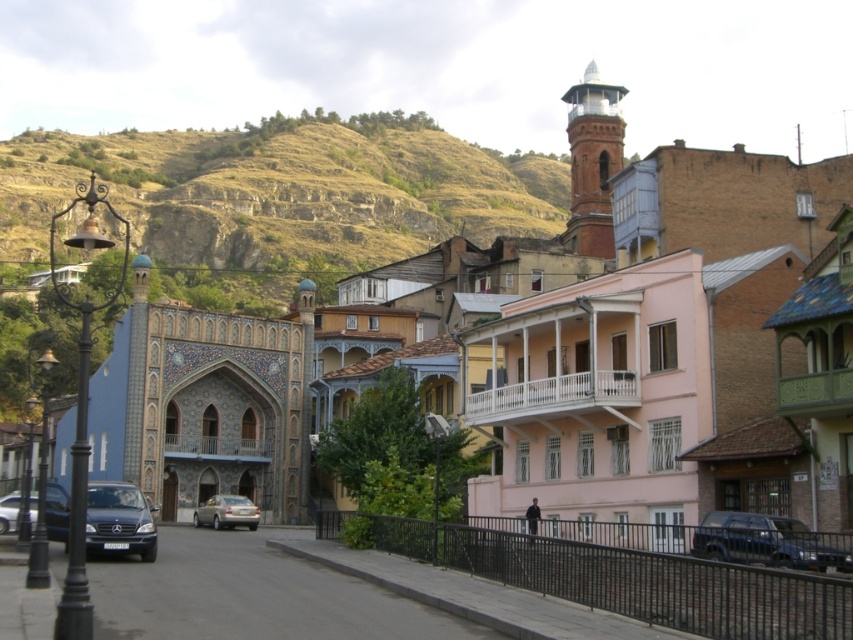
Which of these two, rustic stone hillside at upper left or silver metallic car at center, stands shorter?

With less height is silver metallic car at center.

Is rustic stone hillside at upper left below silver metallic car at center?

No.

This screenshot has height=640, width=853. Describe the element at coordinates (280, 196) in the screenshot. I see `rustic stone hillside at upper left` at that location.

Locate an element on the screen. The height and width of the screenshot is (640, 853). rustic stone hillside at upper left is located at coordinates (280, 196).

Locate an element on the screen. This screenshot has height=640, width=853. rustic stone hillside at upper left is located at coordinates (280, 196).

Can you confirm if rustic stone hillside at upper left is positioned to the left of shiny black sedan at lower left?

Yes, rustic stone hillside at upper left is to the left of shiny black sedan at lower left.

Identify the location of rustic stone hillside at upper left. The image size is (853, 640). coord(280,196).

What are the coordinates of `rustic stone hillside at upper left` in the screenshot? It's located at (280, 196).

Which is more to the right, rustic stone hillside at upper left or shiny black car at center?

shiny black car at center

Who is shorter, rustic stone hillside at upper left or shiny black car at center?

shiny black car at center

Is point (241, 138) farther from camera compared to point (126, 484)?

Yes, it is.

The image size is (853, 640). Identify the location of rustic stone hillside at upper left. (280, 196).